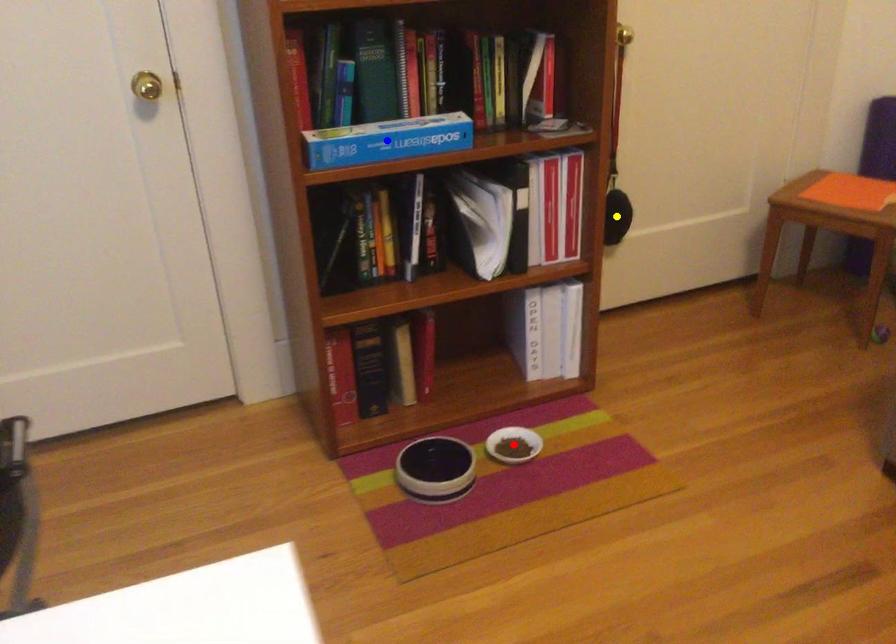
Order these from nearest to farthest:
A) blue point
B) yellow point
C) red point

1. blue point
2. red point
3. yellow point